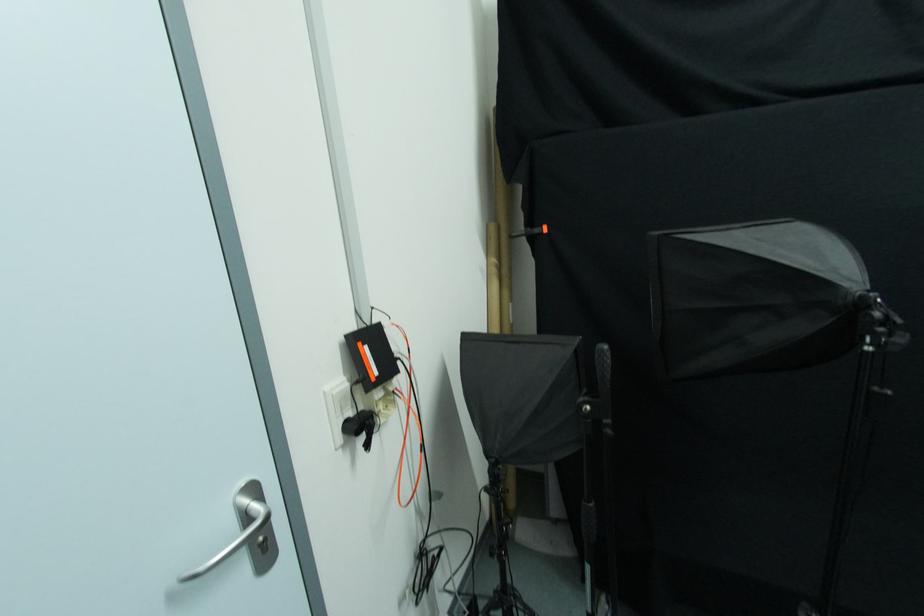
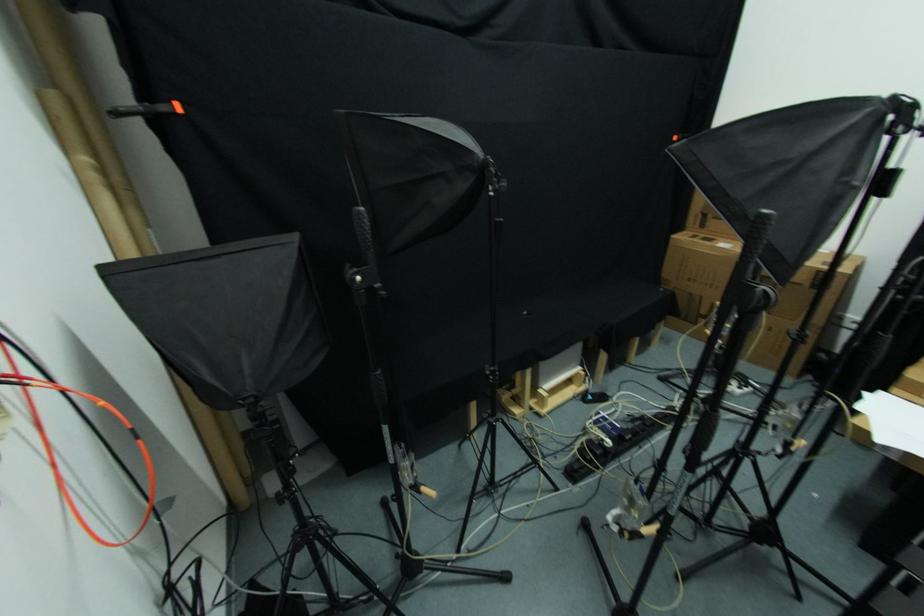
The first image is from the beginning of the video and the second image is from the end. How did the camera likely rotate when shooting the video?

The camera rotated toward right-down.